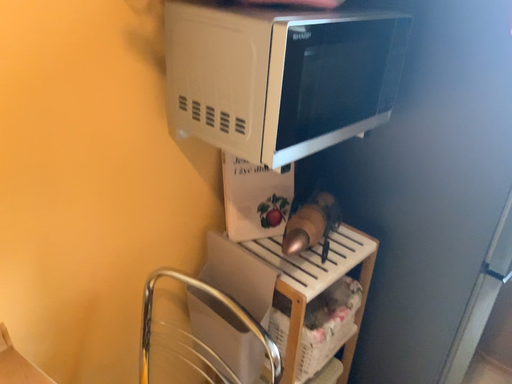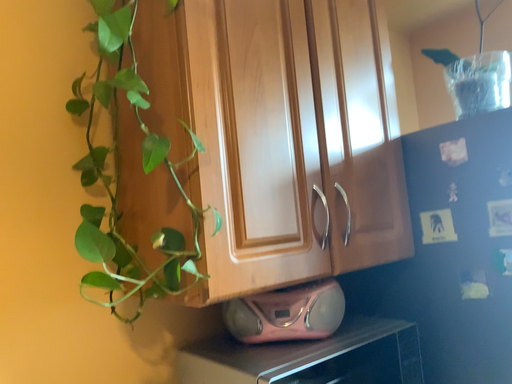
Question: Which way did the camera rotate in the video?

Choices:
 (A) rotated downward
 (B) rotated upward

Answer: (B)